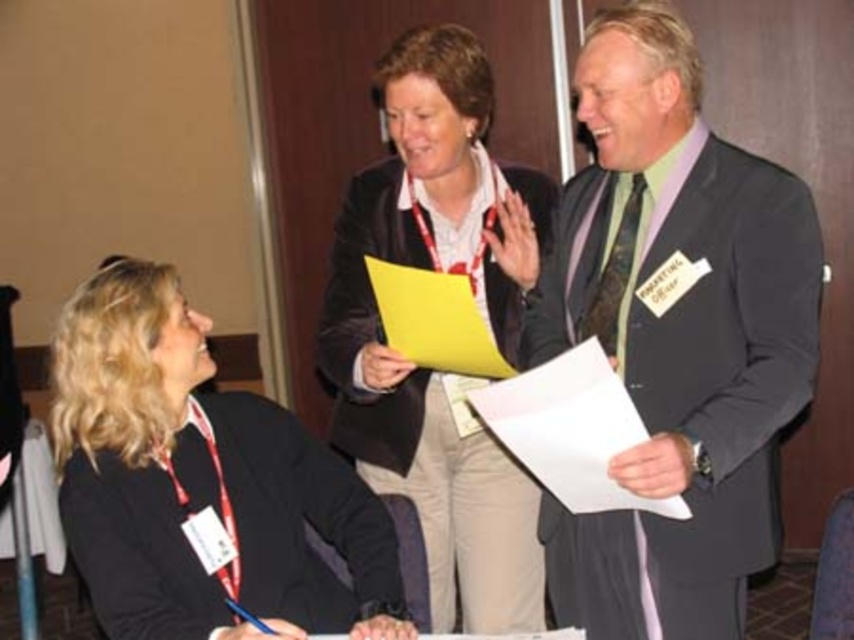
Is point (161, 516) more distant than point (395, 188)?

That is False.

Which is behind, point (95, 374) or point (465, 545)?

Point (465, 545)

Locate an element on the screen. This screenshot has height=640, width=854. black matte jacket at lower left is located at coordinates (197, 481).

Between dark gray suit at center and black matte jacket at lower left, which one is positioned lower?

black matte jacket at lower left is below.

Describe the element at coordinates (676, 337) in the screenshot. I see `dark gray suit at center` at that location.

Does point (774, 477) come in front of point (385, 554)?

Yes, point (774, 477) is closer to viewer.

This screenshot has height=640, width=854. What are the coordinates of `dark gray suit at center` in the screenshot? It's located at (676, 337).

Does point (588, 52) come behind point (377, 365)?

That is False.

Is dark gray suit at center below matte black jacket at center?

No.

Describe the element at coordinates (676, 337) in the screenshot. I see `dark gray suit at center` at that location.

Identify the location of dark gray suit at center. point(676,337).